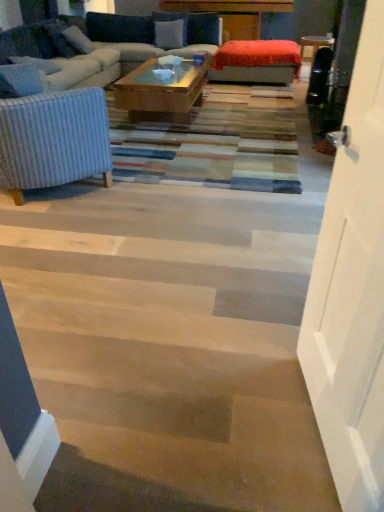
Question: Considering the relative positions of velvet blue pillow at upper center, the second pillow viewed from the top, and white fabric pillow at upper left, acting as the third pillow starting from the top, in the image provided, is velvet blue pillow at upper center, the second pillow viewed from the top, to the left or to the right of white fabric pillow at upper left, acting as the third pillow starting from the top,?

Choices:
 (A) left
 (B) right

Answer: (B)

Question: From their relative heights in the image, would you say velvet blue pillow at upper center, the 3th pillow ordered from the bottom, is taller or shorter than white fabric pillow at upper left, which is the second pillow from front to back?

Choices:
 (A) short
 (B) tall

Answer: (A)

Question: Which of these objects is positioned closest to the white fabric pillow at upper left, marked as the third pillow in a back-to-front arrangement?

Choices:
 (A) wooden floor at lower left
 (B) white wood door at right
 (C) velvet blue pillow at upper center, acting as the 3th pillow starting from the front
 (D) velvet blue couch at upper left
 (E) velvet orange ottoman at center

Answer: (D)

Question: Estimate the real-world distances between objects in this image. Which object is farther from the velvet orange ottoman at center?

Choices:
 (A) velvet blue pillow at upper center, the 3th pillow ordered from the bottom
 (B) white fabric pillow at upper left, which is the second pillow from front to back
 (C) velvet blue couch at upper left
 (D) white wood door at right
 (E) white textured pillow at upper left, which is counted as the first pillow, starting from the front

Answer: (D)